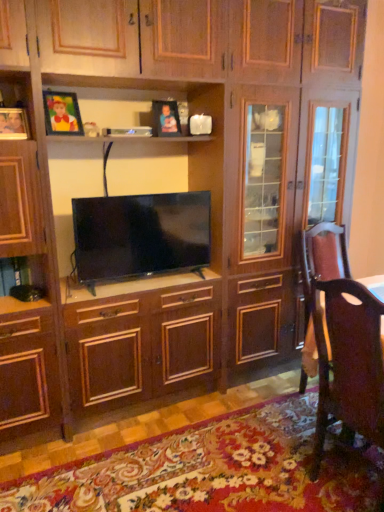
Question: Considering the positions of point (82, 135) and point (3, 110), is point (82, 135) closer or farther from the camera than point (3, 110)?

Choices:
 (A) farther
 (B) closer

Answer: (A)

Question: In terms of size, does matte wooden picture frame at upper left, the second picture frame when ordered from right to left, appear bigger or smaller than matte wooden picture frame at upper left, the first picture frame when ordered from left to right?

Choices:
 (A) big
 (B) small

Answer: (A)

Question: Which object is positioned farthest from the brown leather chair at lower right?

Choices:
 (A) matte plastic picture frame at upper center, the 1th picture frame when ordered from back to front
 (B) matte black tv at center
 (C) matte wooden picture frame at upper left, the first picture frame when ordered from left to right
 (D) matte wooden picture frame at upper left, the second picture frame when ordered from right to left
 (E) brown leather swivel chair at right

Answer: (C)

Question: Which of these objects is positioned closest to the matte wooden picture frame at upper left, the second picture frame when ordered from front to back?

Choices:
 (A) matte plastic picture frame at upper center, the third picture frame in the left-to-right sequence
 (B) brown leather swivel chair at right
 (C) matte wooden picture frame at upper left, the first picture frame from the front
 (D) brown leather chair at lower right
 (E) matte black tv at center

Answer: (C)